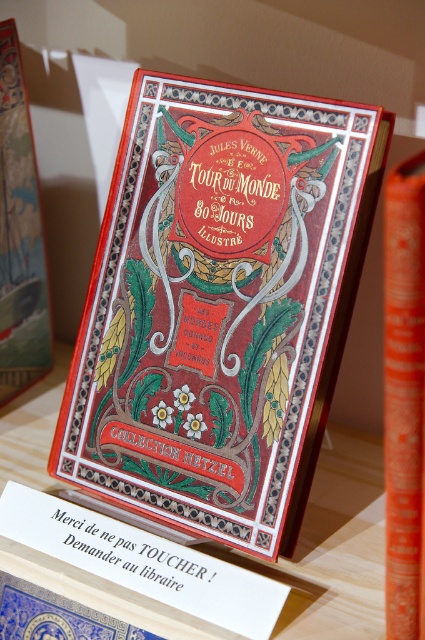
Based on the photo, who is positioned more to the right, orange matte book at center or white paper sign at center?

orange matte book at center is more to the right.

Can you confirm if orange matte book at center is shorter than white paper sign at center?

No.

Who is more forward, [410,544] or [232,618]?

Point [410,544] is in front.

Identify the location of orange matte book at center. [404, 397].

From the picture: Does matte red book at center have a lesser width compared to white paper sign at center?

No.

Can you confirm if matte red book at center is smaller than white paper sign at center?

No, matte red book at center is not smaller than white paper sign at center.

You are a GUI agent. You are given a task and a screenshot of the screen. Output one action in this format:
    pyautogui.click(x=<x>, y=<y>)
    Task: Click on the matte red book at center
    
    Given the screenshot: What is the action you would take?
    pyautogui.click(x=220, y=305)

Is point (342, 467) behind point (388, 464)?

Yes, it is.

Between matte wood table at center and orange matte book at center, which one has more height?

→ orange matte book at center

Consider the image. Who is more forward, (42, 385) or (405, 188)?

Positioned in front is point (405, 188).

What are the coordinates of `matte wood table at center` in the screenshot? It's located at (333, 547).